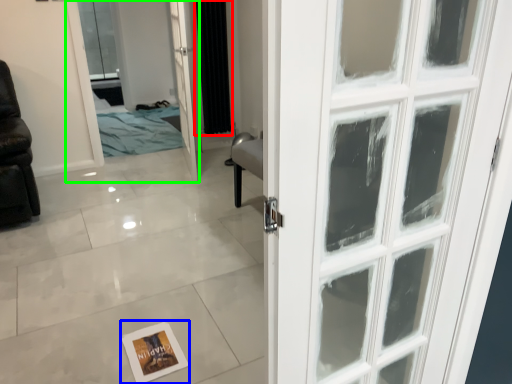
Question: Considering the real-world distances, which object is farthest from curtain (highlighted by a red box)? postcard (highlighted by a blue box) or elevator (highlighted by a green box)?

Choices:
 (A) postcard
 (B) elevator

Answer: (A)